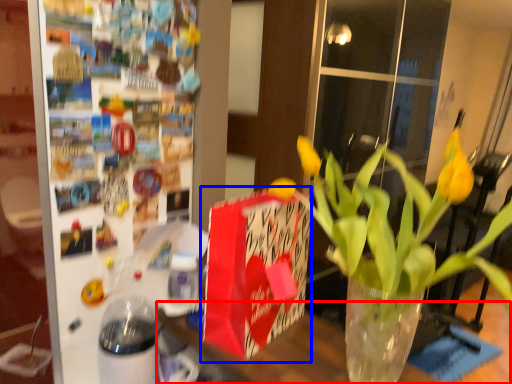
Question: Among these objects, which one is farthest to the camera, table (highlighted by a red box) or gift bag (highlighted by a blue box)?

Choices:
 (A) table
 (B) gift bag

Answer: (B)